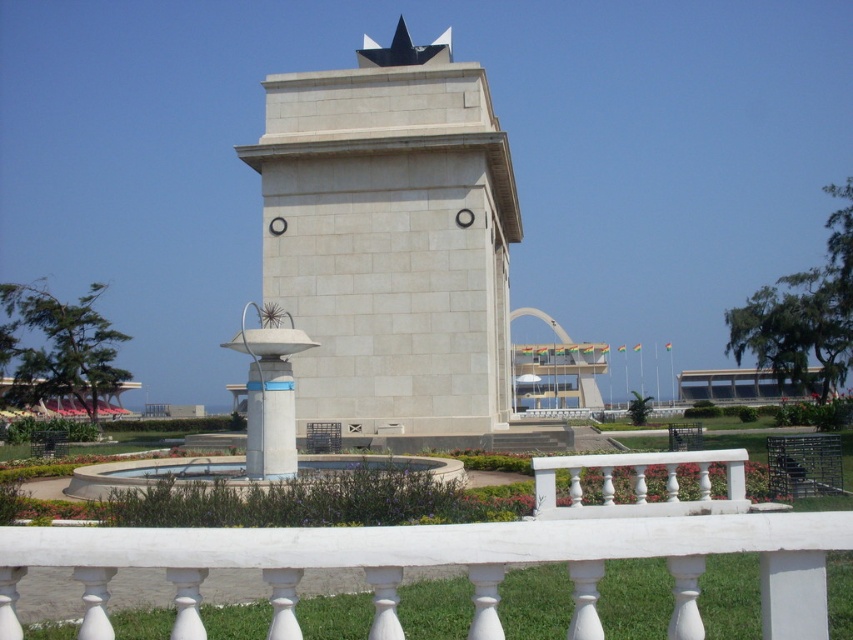
How much distance is there between white stone tower at center and blue glossy pedestal at center?

They are 8.91 meters apart.

Who is shorter, white stone tower at center or blue glossy pedestal at center?

blue glossy pedestal at center

This screenshot has height=640, width=853. Identify the location of white stone tower at center. (390, 240).

Which of these two, white marble balustrade at lower center or blue glossy pedestal at center, stands taller?

blue glossy pedestal at center

Can you confirm if white marble balustrade at lower center is wider than blue glossy pedestal at center?

In fact, white marble balustrade at lower center might be narrower than blue glossy pedestal at center.

Does point (699, 614) lie in front of point (271, 428)?

Yes, it is.

Identify the location of white marble balustrade at lower center. (440, 564).

Is point (448, 289) positioned after point (630, 557)?

Yes, it is.

Find the location of a particular element. The width and height of the screenshot is (853, 640). white stone tower at center is located at coordinates (390, 240).